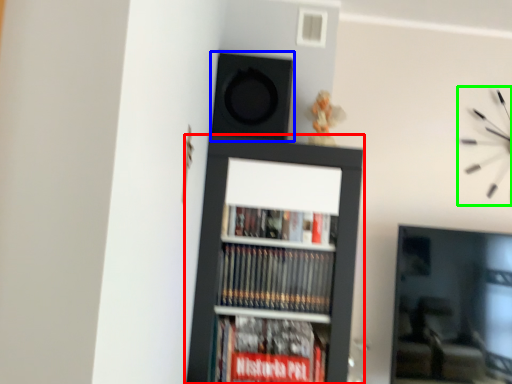
Question: Considering the real-world distances, which object is closest to bookcase (highlighted by a red box)? speaker (highlighted by a blue box) or clock (highlighted by a green box).

Choices:
 (A) speaker
 (B) clock

Answer: (A)